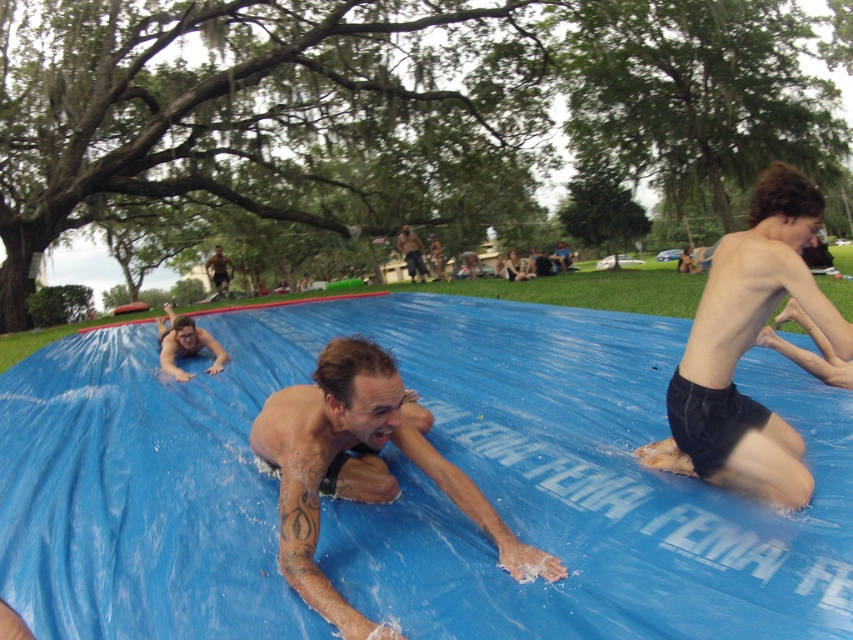
Describe the element at coordinates (360, 467) in the screenshot. Image resolution: width=853 pixels, height=640 pixels. I see `tattooed skin at center` at that location.

Does tattooed skin at center have a lesser width compared to dark brown hair at upper center?

Correct, tattooed skin at center's width is less than dark brown hair at upper center's.

The width and height of the screenshot is (853, 640). I want to click on tattooed skin at center, so click(360, 467).

Which is above, black matte shorts at center or dark brown hair at upper center?

dark brown hair at upper center is above.

Can you confirm if black matte shorts at center is bigger than dark brown hair at upper center?

Actually, black matte shorts at center might be smaller than dark brown hair at upper center.

The height and width of the screenshot is (640, 853). Identify the location of black matte shorts at center. (746, 349).

Locate an element on the screen. The image size is (853, 640). black matte shorts at center is located at coordinates (746, 349).

Is point (723, 332) positioned before point (412, 269)?

Yes, it is.

The image size is (853, 640). Identify the location of black matte shorts at center. (746, 349).

Image resolution: width=853 pixels, height=640 pixels. I want to click on black matte shorts at center, so click(746, 349).